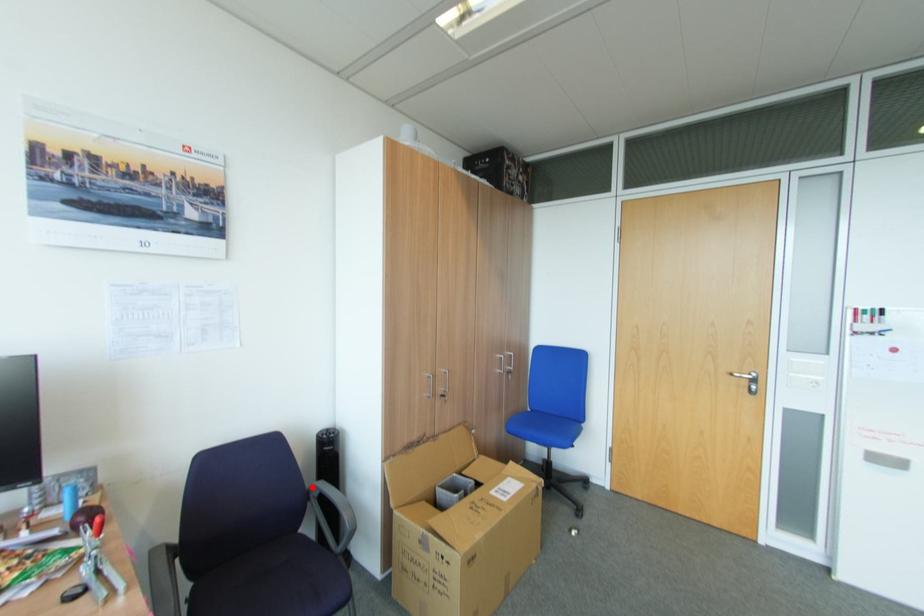
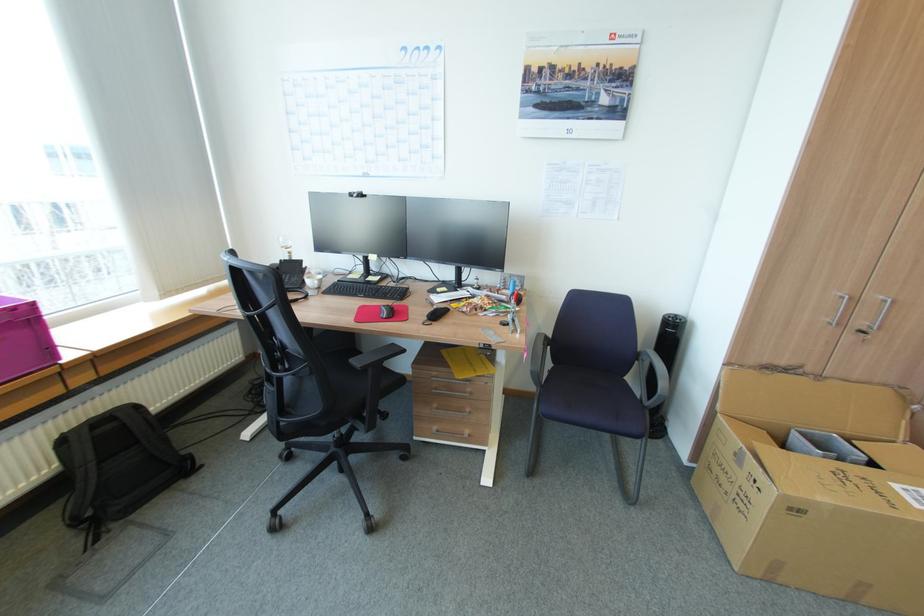
In the second image, find the point that corresponds to the highlighted location in the first image.

(643, 350)